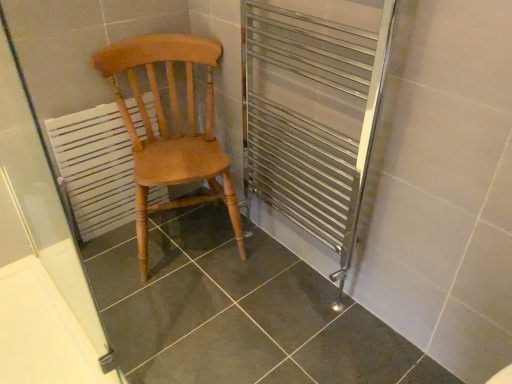
This screenshot has width=512, height=384. In order to click on vacant area situated below light brown wood chair at center (from a real-world perspective) in this screenshot , I will do `click(188, 235)`.